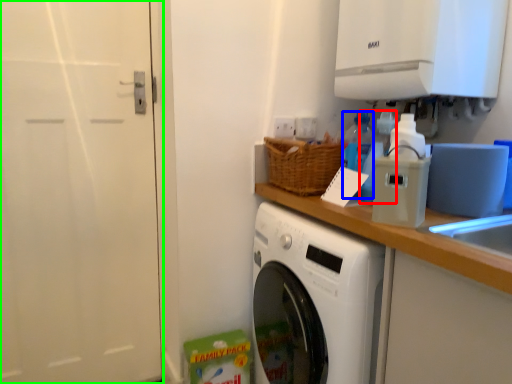
Question: Considering the real-world distances, which object is farthest from bottle (highlighted by a red box)? bottle (highlighted by a blue box) or screen door (highlighted by a green box)?

Choices:
 (A) bottle
 (B) screen door

Answer: (B)